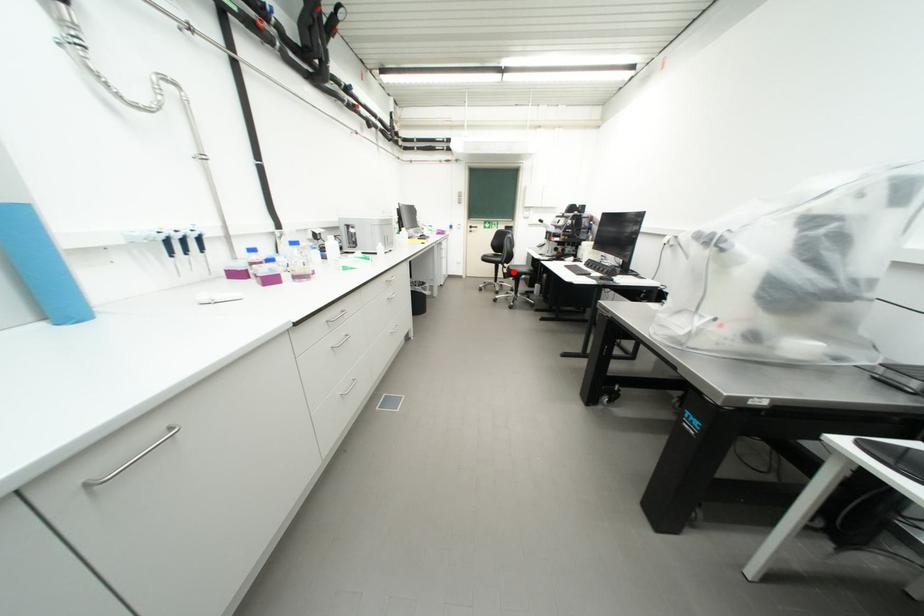
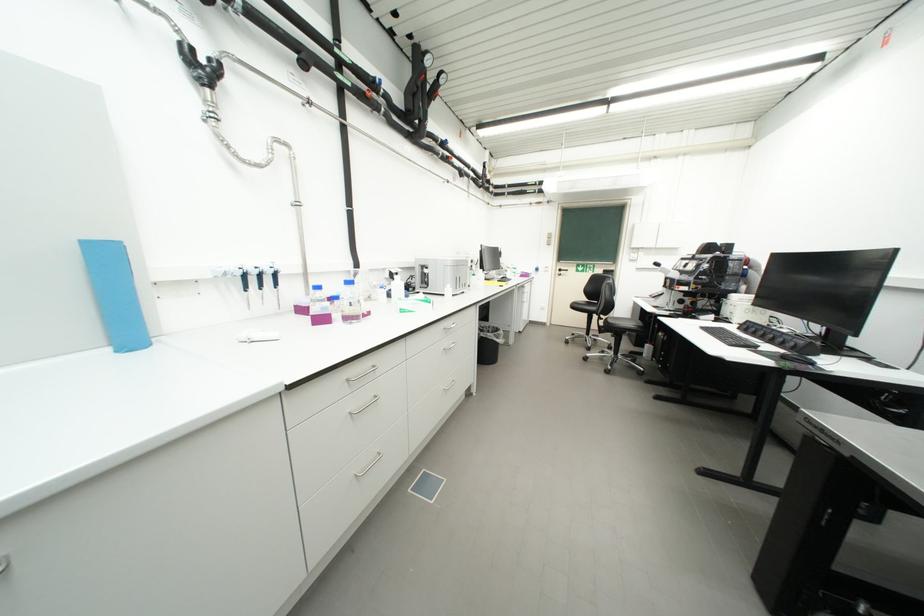
Question: I am providing you with two images of the same scene from different viewpoints. In image1, a red point is highlighted. Considering the same 3D point in image2, which of the following is correct?

Choices:
 (A) It is closer
 (B) It is farther

Answer: (B)